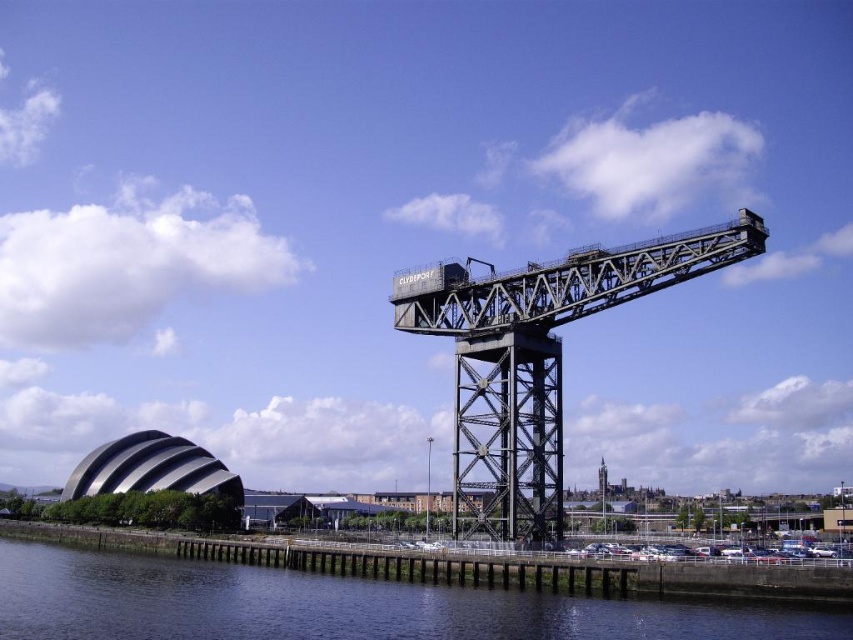
From the picture: You are standing on the wooden pier and want to take a photo of the black steel crane at center. However, there is dark blue water at lower center in your way. Can you still see the crane through the water?

The dark blue water at lower center is closer to the viewer than the black steel crane at center, so the water will block your view of the crane.

You are a photographer trying to capture the black steel crane at center in your shot. You are standing at the dark blue water at lower center. Can you see the entire crane in your viewfinder without moving your position?

The dark blue water at lower center has a lesser height compared to black steel crane at center, so yes, you can see the entire crane in your viewfinder without moving your position because the water is lower and won